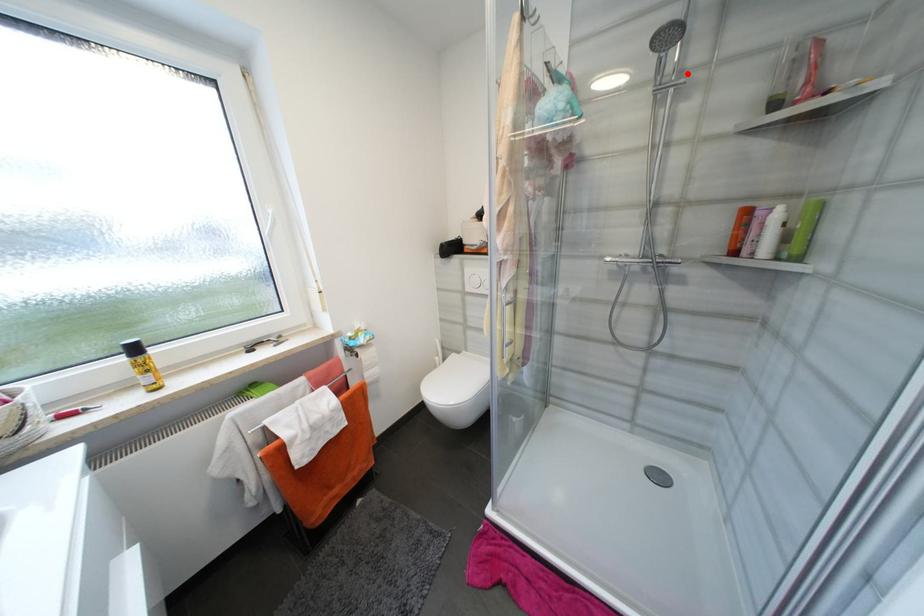
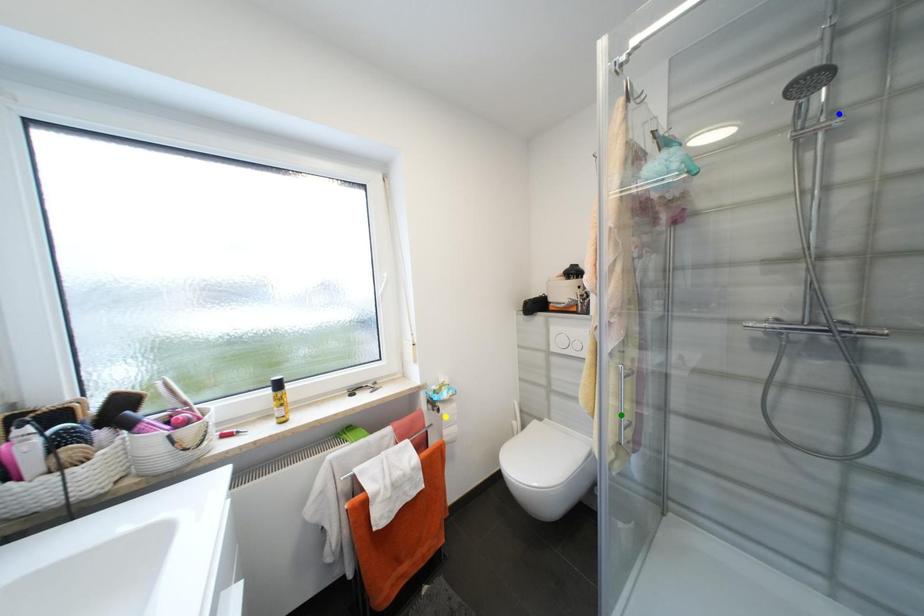
Question: I am providing you with two images of the same scene from different viewpoints. A red point is marked on the first image. You are given multiple points on the second image. Can you choose the point in image 2 that corresponds to the point in image 1?

Choices:
 (A) blue point
 (B) yellow point
 (C) green point

Answer: (A)